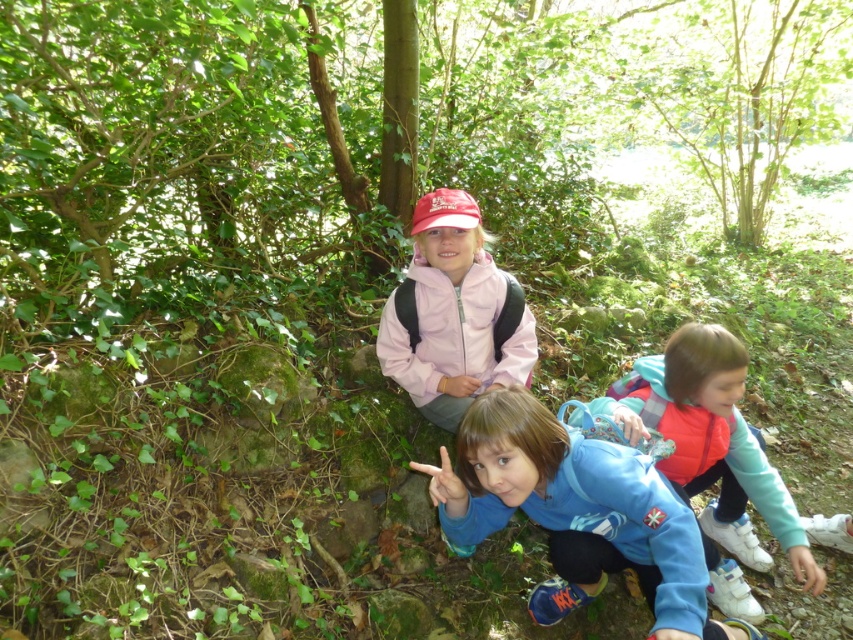
Question: Is green leafy tree at upper center above pink matte jacket at center?

Choices:
 (A) no
 (B) yes

Answer: (B)

Question: Which point appears farthest from the camera in this image?

Choices:
 (A) 445,404
 (B) 735,378
 (C) 711,56
 (D) 419,467

Answer: (C)

Question: Which is nearer to the blue fleece jacket at lower right?

Choices:
 (A) blue fleece jacket at center
 (B) green leafy tree at upper center

Answer: (A)

Question: Is blue fleece jacket at center to the right of pink matte jacket at center from the viewer's perspective?

Choices:
 (A) no
 (B) yes

Answer: (B)

Question: Which object is positioned closest to the blue fleece jacket at lower right?

Choices:
 (A) blue fleece jacket at center
 (B) pink matte jacket at center

Answer: (A)

Question: Is green leafy tree at upper center to the left of pink matte jacket at center from the viewer's perspective?

Choices:
 (A) yes
 (B) no

Answer: (B)